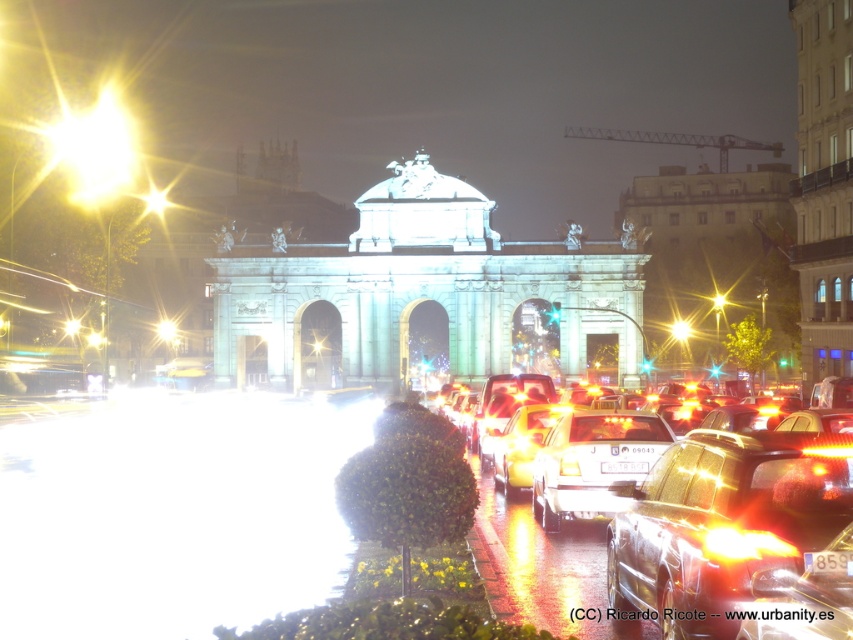
Question: Is metallic silver sedan at center positioned at the back of shiny orange car at center?

Choices:
 (A) no
 (B) yes

Answer: (B)

Question: Which point is farther from the camera taking this photo?

Choices:
 (A) (589, 442)
 (B) (727, 474)
 (C) (817, 582)

Answer: (A)

Question: Is metallic silver sedan at center further to camera compared to shiny metallic car at center?

Choices:
 (A) yes
 (B) no

Answer: (B)

Question: Estimate the real-world distances between objects in this image. Which object is farther from the shiny metallic car at center?

Choices:
 (A) metallic silver sedan at center
 (B) metallic silver car at center
 (C) shiny orange car at center

Answer: (C)

Question: Which point is farther to the camera?

Choices:
 (A) (846, 608)
 (B) (648, 550)
 (C) (741, 572)
 (D) (566, 486)

Answer: (D)

Question: Where is metallic silver car at center located in relation to shiny metallic car at center in the image?

Choices:
 (A) above
 (B) below

Answer: (B)